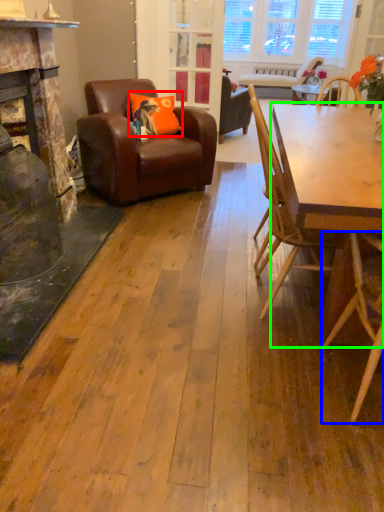
Question: Estimate the real-world distances between objects in this image. Which object is closer to pillow (highlighted by a red box), chair (highlighted by a blue box) or round table (highlighted by a green box)?

Choices:
 (A) chair
 (B) round table

Answer: (B)